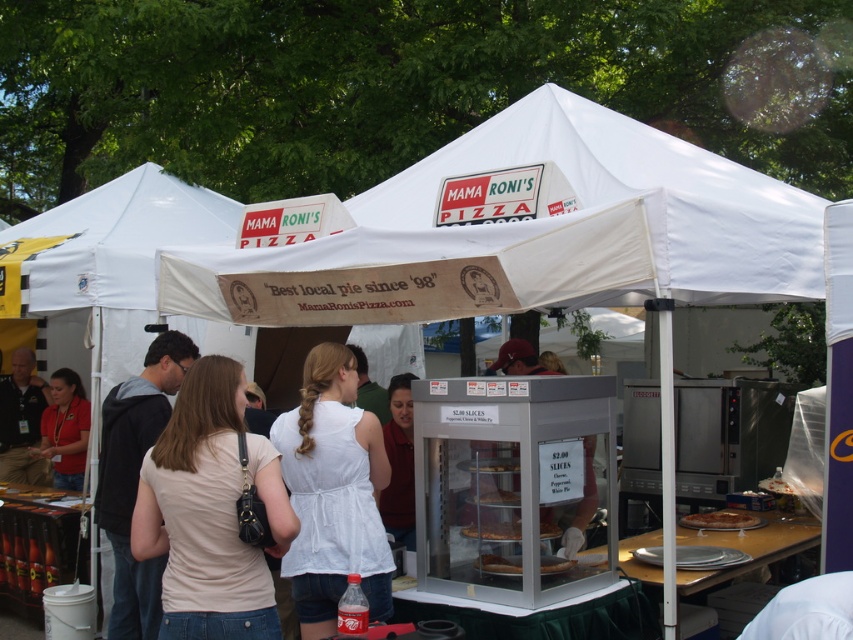
You are a customer at Mama Roni Pizza and you want to place an order. The cashier points to two points on the menu board to indicate the location of the pizza you ordered. The first point is at coordinate point [430,282] and the second is at point [49,381]. Which point is closer to you?

Point [430,282] is in front of point [49,381], so it is closer to you.

You are a customer at Mama Roni Pizza and want to grab the golden crispy pizza at center. You are currently standing in front of the matte red shirt at lower left. Which direction should you move to reach the pizza?

The matte red shirt at lower left is closer to you than the golden crispy pizza at center. To reach the pizza, you need to move away from the matte red shirt at lower left towards the center of the tent.

Looking at this image, you are a customer standing at the entrance of the food stall. You want to reach the matte red shirt at lower left from your current position. The path is clear except for the white fabric tent at center. Can you walk around the tent to reach the shirt without going through it?

The white fabric tent at center and matte red shirt at lower left are 3.97 meters apart. Since the path is clear except for the tent, you can walk around the tent to reach the shirt without going through it.